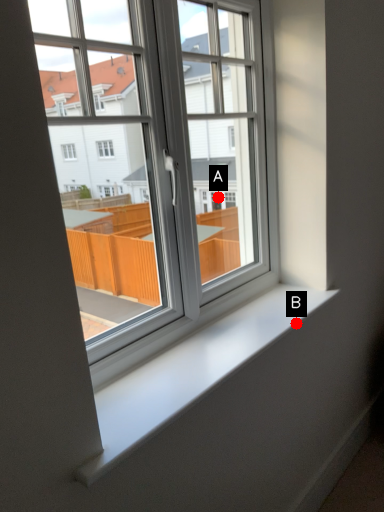
Question: Two points are circled on the image, labeled by A and B beside each circle. Among these points, which one is nearest to the camera?

Choices:
 (A) A is closer
 (B) B is closer

Answer: (B)